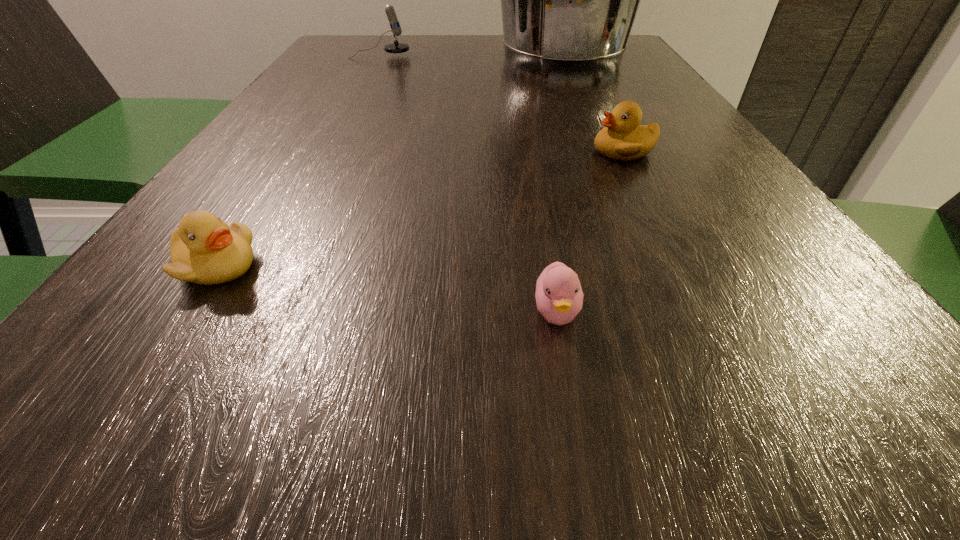
You are a GUI agent. You are given a task and a screenshot of the screen. Output one action in this format:
    pyautogui.click(x=<x>, y=<y>)
    Task: Click on the free location that satisfies the following two spatial constraints: 1. on the front side of the bucket; 2. on the left side of the second tallest object
    The height and width of the screenshot is (540, 960).
    Given the screenshot: What is the action you would take?
    [378, 58]